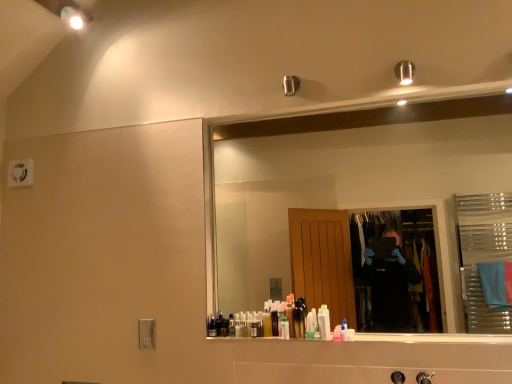
Question: Looking at their shapes, would you say clear glass mirror at upper center is wider or thinner than translucent plastic bottle at center, which is the third toiletry from left to right?

Choices:
 (A) thin
 (B) wide

Answer: (B)

Question: Considering the positions of point (357, 140) and point (295, 329), is point (357, 140) closer or farther from the camera than point (295, 329)?

Choices:
 (A) farther
 (B) closer

Answer: (A)

Question: Considering the real-world distances, which object is closest to the translucent plastic bottle at center, which is the third toiletry from right to left?

Choices:
 (A) brushed metal shower at upper center
 (B) translucent plastic tube at center, the second toiletry viewed from the left
 (C) clear glass mirror at upper center
 (D) pink translucent bottle at center, the 6th toiletry from the left
 (E) translucent plastic bottle at center, which is the 6th toiletry from right to left

Answer: (B)

Question: Which is farther from the white glossy lotion at center, which is the fifth toiletry from left to right?

Choices:
 (A) translucent plastic bottle at center, the 4th toiletry when ordered from right to left
 (B) translucent plastic bottle at center, which is the 6th toiletry from right to left
 (C) pink translucent bottle at center, the 6th toiletry from the left
 (D) translucent plastic tube at center, the fifth toiletry viewed from the right
 (E) brushed metal shower at upper center

Answer: (E)